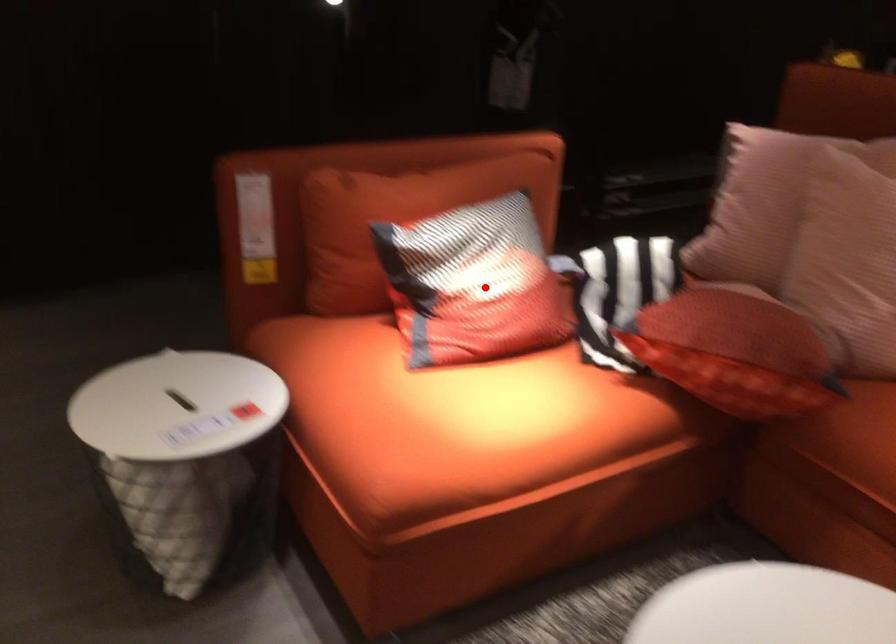
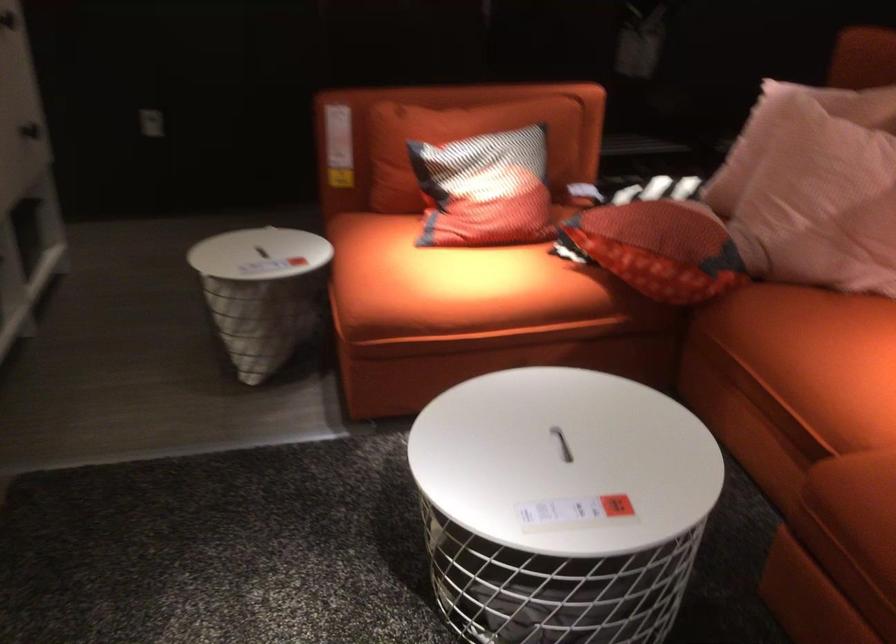
In the second image, find the point that corresponds to the highlighted location in the first image.

(485, 190)